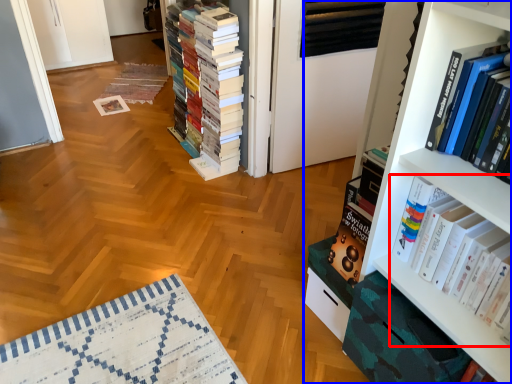
Question: Which of the following is the closest to the observer, book (highlighted by a red box) or bookcase (highlighted by a blue box)?

Choices:
 (A) book
 (B) bookcase

Answer: (A)